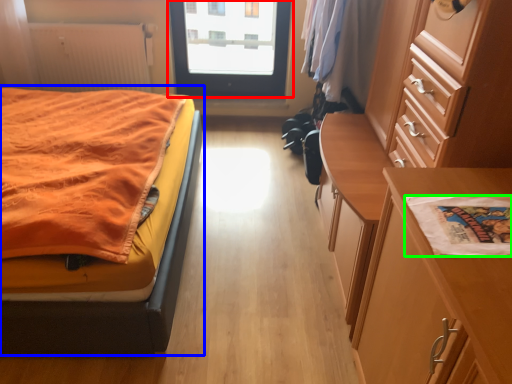
Question: Which is farther away from door (highlighted by a red box)? bed (highlighted by a blue box) or linen (highlighted by a green box)?

Choices:
 (A) bed
 (B) linen

Answer: (B)